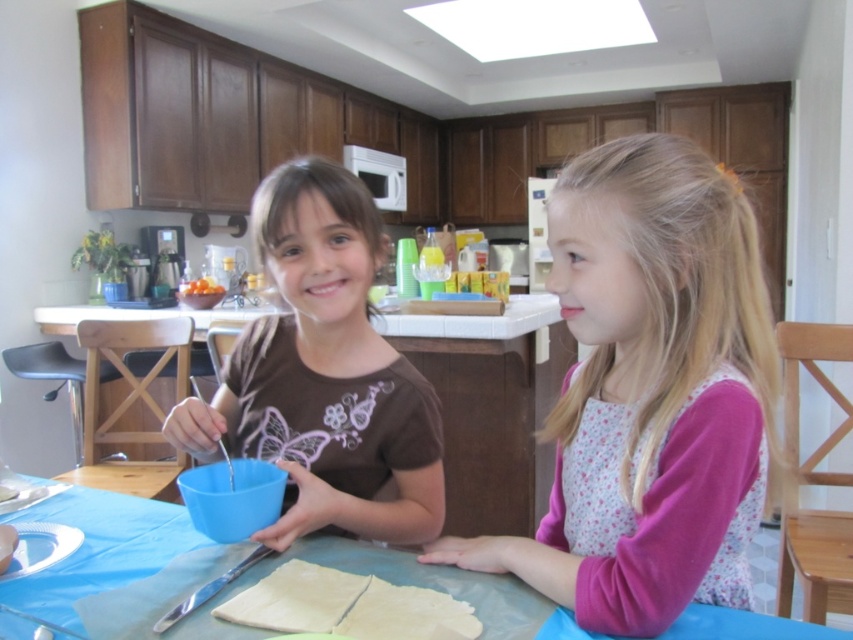
You are trying to place a tall glass on the blue plastic table at center. The blue plastic bowl at center is already on the table. Can the glass be placed on the table without touching the bowl?

The blue plastic bowl at center is much taller than the blue plastic table at center, so placing a tall glass on the table might cause it to touch the bowl since the bowl already occupies vertical space on the table.